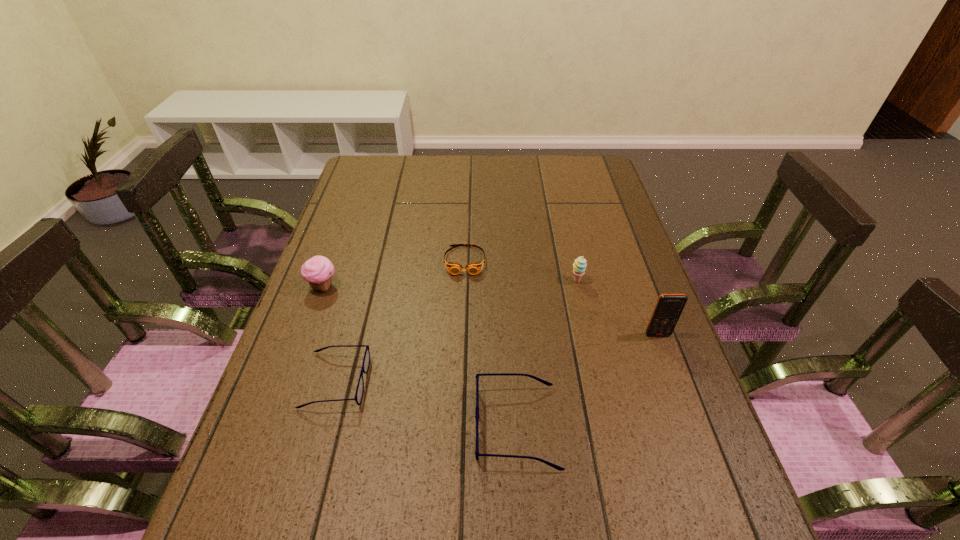
Locate an element on the screen. blank space that satisfies the following two spatial constraints: 1. with the lenses facing forward on the sherbert; 2. on the right side of the goggles is located at coordinates (464, 281).